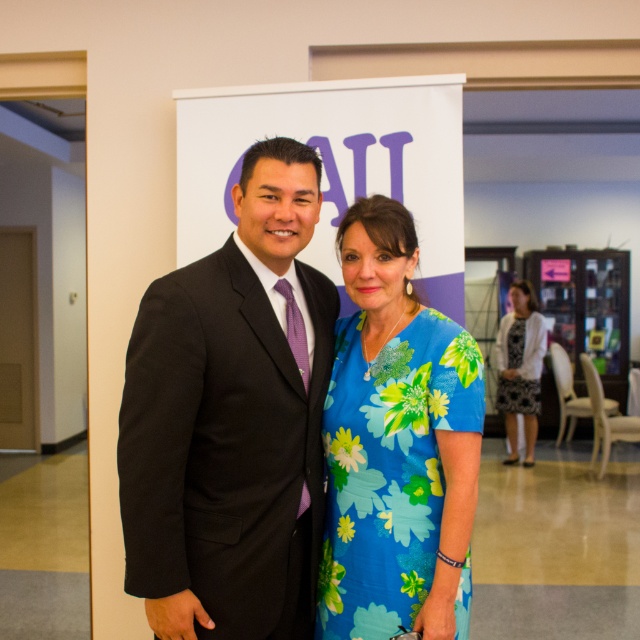
Question: Among these points, which one is farthest from the camera?

Choices:
 (A) (128, 500)
 (B) (499, 385)
 (C) (416, 456)

Answer: (B)

Question: Can you confirm if floral-patterned fabric dress at center is bigger than black floral dress at right?

Choices:
 (A) yes
 (B) no

Answer: (B)

Question: Is matte black suit at center bigger than floral-patterned fabric dress at center?

Choices:
 (A) no
 (B) yes

Answer: (B)

Question: Does matte black suit at center have a greater width compared to floral-patterned fabric dress at center?

Choices:
 (A) yes
 (B) no

Answer: (A)

Question: Based on their relative distances, which object is nearer to the black floral dress at right?

Choices:
 (A) floral-patterned fabric dress at center
 (B) matte black suit at center

Answer: (A)

Question: Estimate the real-world distances between objects in this image. Which object is farther from the matte black suit at center?

Choices:
 (A) floral-patterned fabric dress at center
 (B) black floral dress at right

Answer: (B)